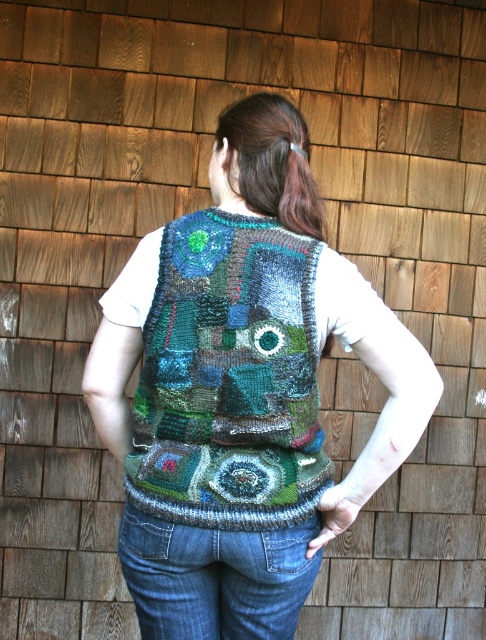
You are a fashion designer observing the image. You need to determine the layering order of the knitted multicolored vest at center and the denim at lower center. Which one is covering the other?

The knitted multicolored vest at center is in front of denim at lower center, so the vest is covering the denim.